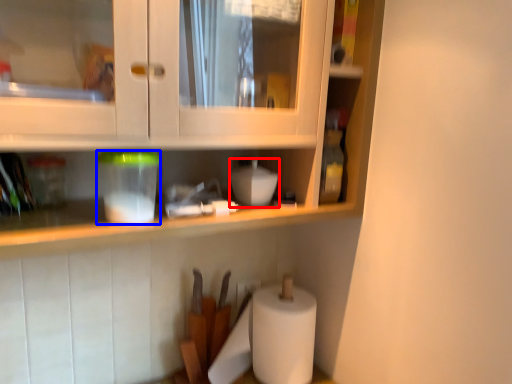
Question: Which object is closer to the camera taking this photo, appliance (highlighted by a red box) or appliance (highlighted by a blue box)?

Choices:
 (A) appliance
 (B) appliance

Answer: (B)